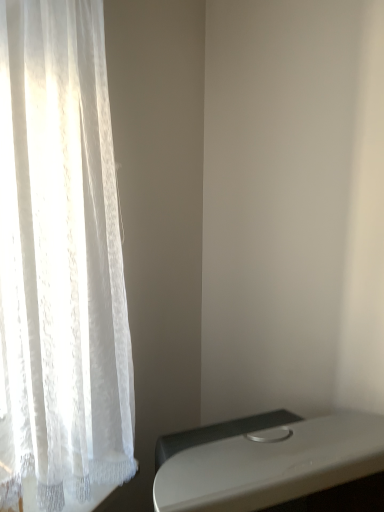
What do you see at coordinates (274, 465) in the screenshot? This screenshot has height=512, width=384. I see `white glossy table at lower right` at bounding box center [274, 465].

Measure the distance between white glossy table at lower right and camera.

A distance of 35.77 inches exists between white glossy table at lower right and camera.

Where is `white glossy table at lower right`? The image size is (384, 512). white glossy table at lower right is located at coordinates [274, 465].

Locate an element on the screen. Image resolution: width=384 pixels, height=512 pixels. white glossy table at lower right is located at coordinates (274, 465).